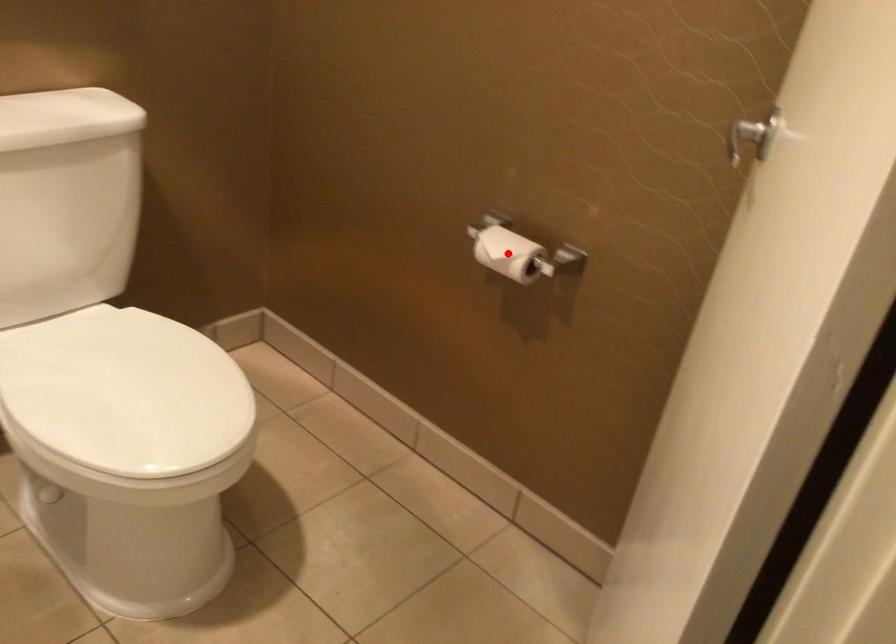
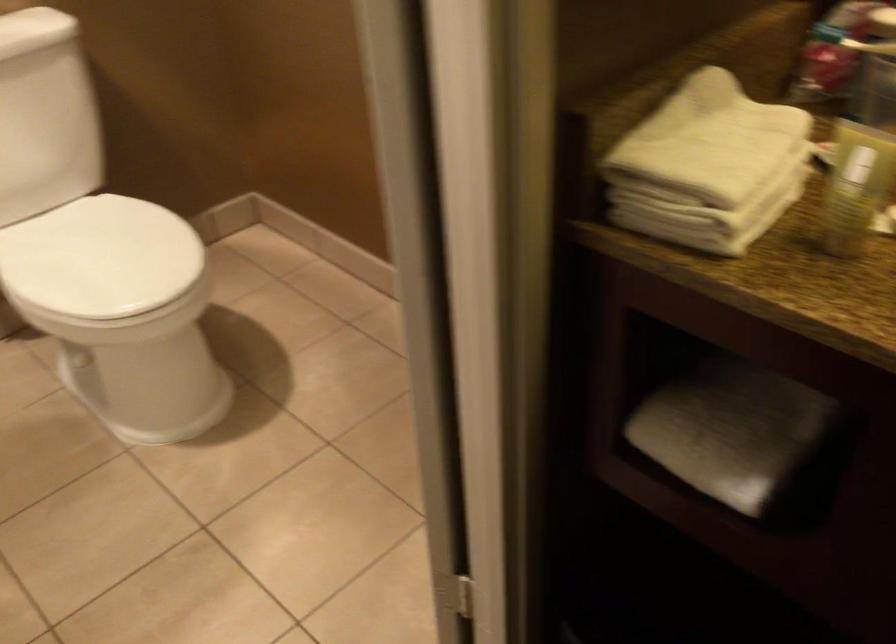
Question: I am providing you with two images of the same scene from different viewpoints. A red point is marked on the first image. Is the red point's position out of view in image 2?

Choices:
 (A) Yes
 (B) No

Answer: (A)